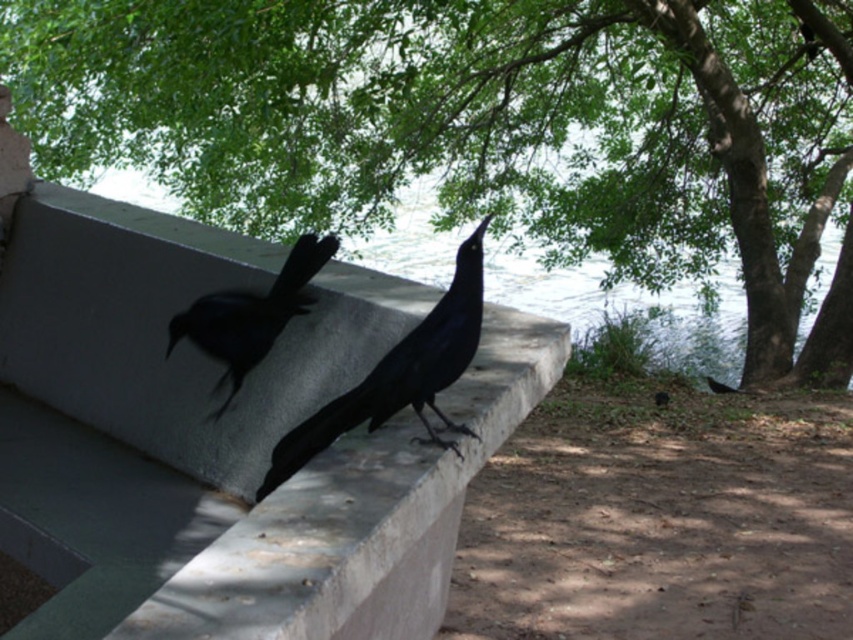
Question: Which object is positioned closest to the shiny black bird at center?

Choices:
 (A) smooth concrete ledge at center
 (B) shiny black crow at center
 (C) green leafy tree at upper center

Answer: (B)

Question: Does shiny black bird at center lie in front of shiny black crow at center?

Choices:
 (A) no
 (B) yes

Answer: (B)

Question: Which is farther from the shiny black crow at center?

Choices:
 (A) shiny black bird at center
 (B) smooth concrete ledge at center
 (C) green leafy tree at upper center

Answer: (C)

Question: Is green leafy tree at upper center behind smooth concrete ledge at center?

Choices:
 (A) no
 (B) yes

Answer: (B)

Question: In this image, where is shiny black bird at center located relative to shiny black crow at center?

Choices:
 (A) above
 (B) below

Answer: (B)

Question: Which object is farther from the camera taking this photo?

Choices:
 (A) green leafy tree at upper center
 (B) shiny black crow at center

Answer: (A)